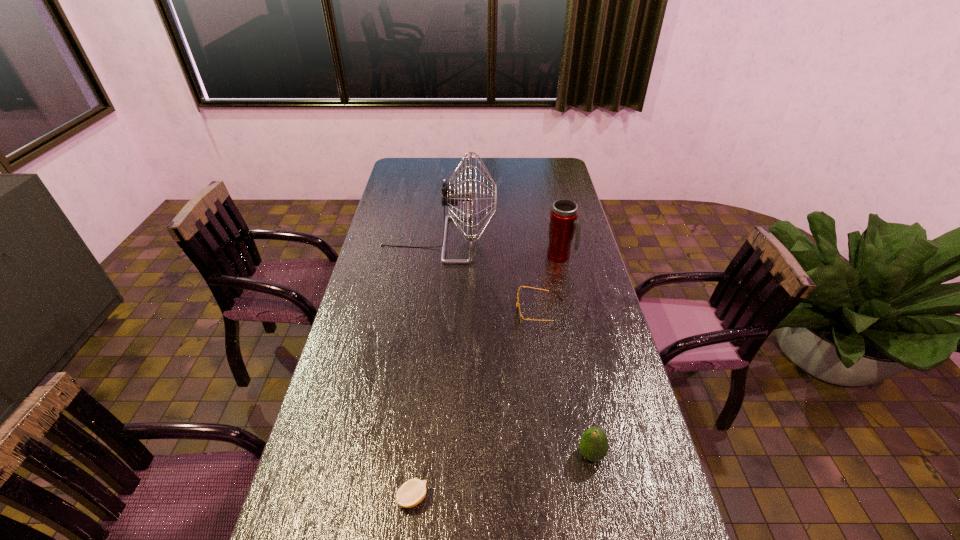
Where is `vacant space at the right edge of the desktop`? vacant space at the right edge of the desktop is located at coordinates (615, 404).

Find the location of a particular element. free space at the far right corner of the desktop is located at coordinates (543, 174).

Where is `free spot between the thermos bottle and the sunglasses`? free spot between the thermos bottle and the sunglasses is located at coordinates (550, 285).

This screenshot has width=960, height=540. Find the location of `free space between the thermos bottle and the avocado`. free space between the thermos bottle and the avocado is located at coordinates (576, 355).

This screenshot has height=540, width=960. Identify the location of vacant area that lies between the nearest object and the fourth farthest object. (502, 476).

This screenshot has height=540, width=960. In order to click on blank region between the second tallest object and the fourth tallest object in this screenshot , I will do `click(550, 285)`.

Where is `unoccupied position between the thermos bottle and the fan`? The width and height of the screenshot is (960, 540). unoccupied position between the thermos bottle and the fan is located at coordinates (499, 248).

I want to click on vacant region between the fourth shortest object and the nearest object, so click(x=486, y=377).

At what (x,y) coordinates should I click in order to perform the action: click on empty space that is in between the fan and the nearest object. Please return your answer as a coordinate pair (x, y). Image resolution: width=960 pixels, height=540 pixels. Looking at the image, I should click on (425, 369).

At what (x,y) coordinates should I click in order to perform the action: click on vacant area that lies between the avocado and the lemon. Please return your answer as a coordinate pair (x, y). Image resolution: width=960 pixels, height=540 pixels. Looking at the image, I should click on (502, 476).